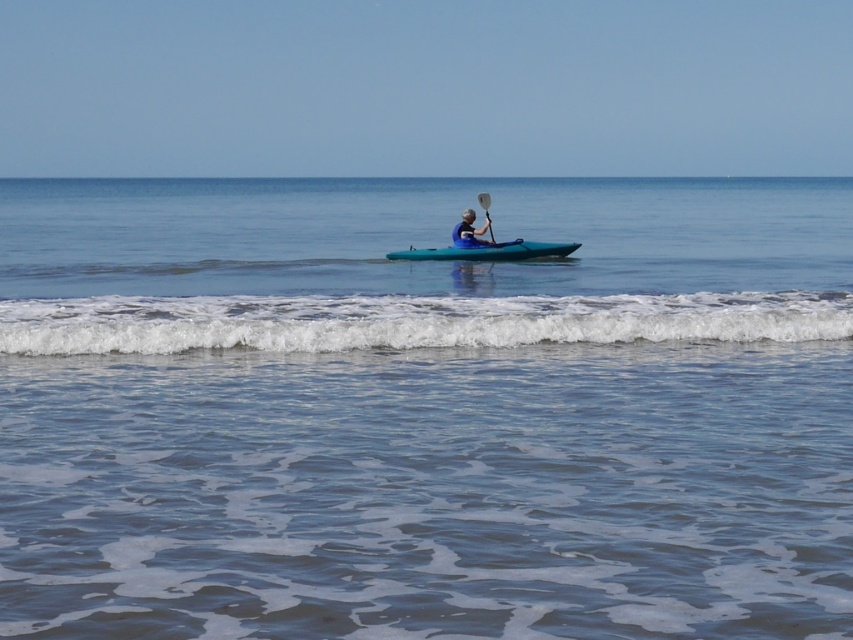
You are a drone operator trying to capture the kayaker in the center of the image. The kayaker is in the turquoise kayak. The clear blue water at center is at point 0.642, 0.498. Where should you position the drone to ensure the kayaker is centered in the shot?

The clear blue water at center is located at point (424, 410), so positioning the drone at this coordinate will center the kayaker in the shot.

You are standing on the beach looking out at the scene. Which object is closer to you between the clear blue water at center and the teal glossy canoe at center?

The clear blue water at center is closer to you than the teal glossy canoe at center.

You are a photographer trying to capture the reflection of the teal glossy canoe at center in the clear blue water at center. Based on the scene description, can you confirm if the reflection is visible?

The clear blue water at center is located above the teal glossy canoe at center, which means the canoe is submerged or below the water surface. Therefore, the reflection of the teal glossy canoe at center would not be visible on the water surface.